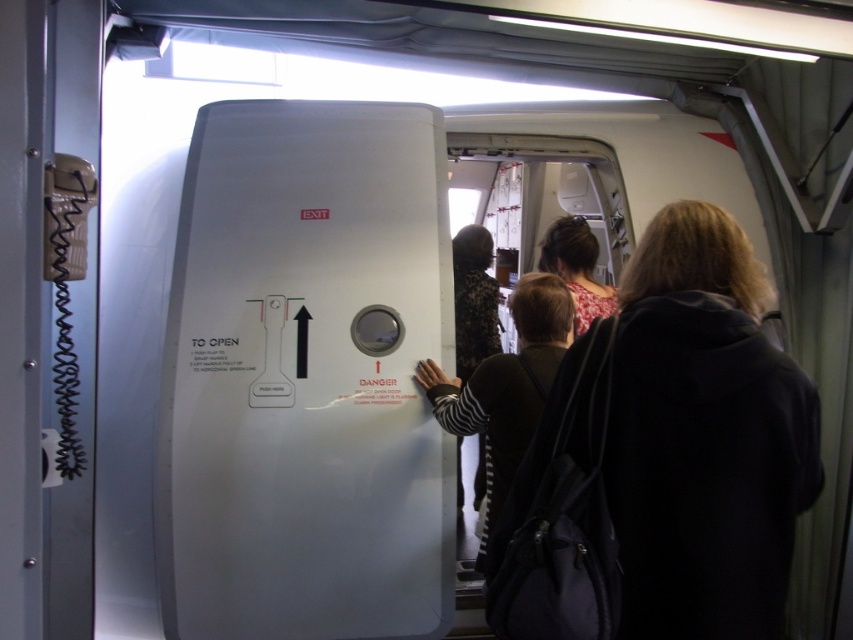
Question: Where is dark brown hair at center located in relation to floral-patterned fabric dress at center in the image?

Choices:
 (A) below
 (B) above

Answer: (A)

Question: Is dark brown hair at center smaller than floral-patterned fabric dress at center?

Choices:
 (A) no
 (B) yes

Answer: (A)

Question: Does dark brown hair at center have a smaller size compared to floral fabric dress at center?

Choices:
 (A) yes
 (B) no

Answer: (B)

Question: Which is farther from the floral-patterned fabric dress at center?

Choices:
 (A) floral fabric dress at center
 (B) dark brown hair at center

Answer: (B)

Question: Which point appears farthest from the camera in this image?

Choices:
 (A) (563, 220)
 (B) (480, 244)

Answer: (B)

Question: Among these objects, which one is nearest to the camera?

Choices:
 (A) floral fabric dress at center
 (B) floral-patterned fabric dress at center
 (C) dark brown hair at center

Answer: (C)